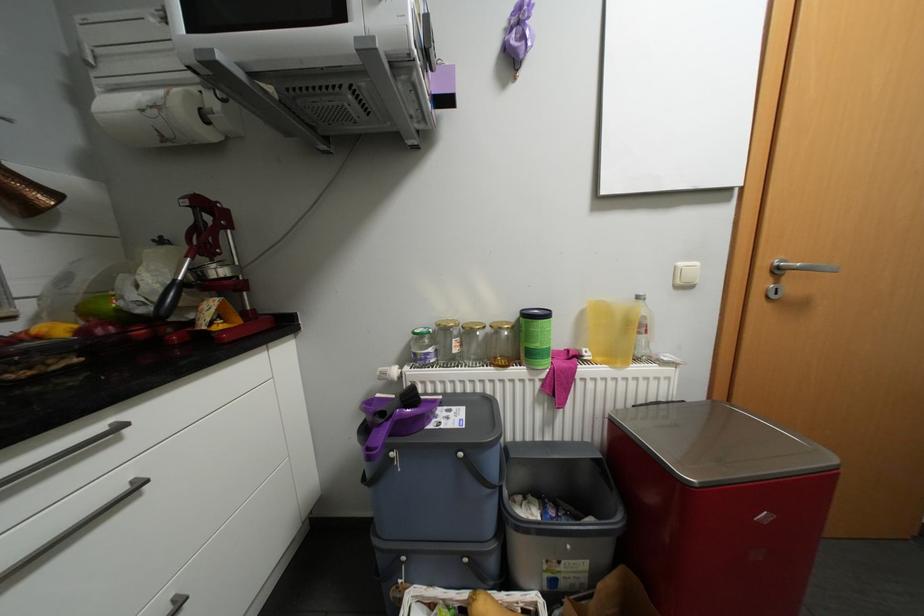
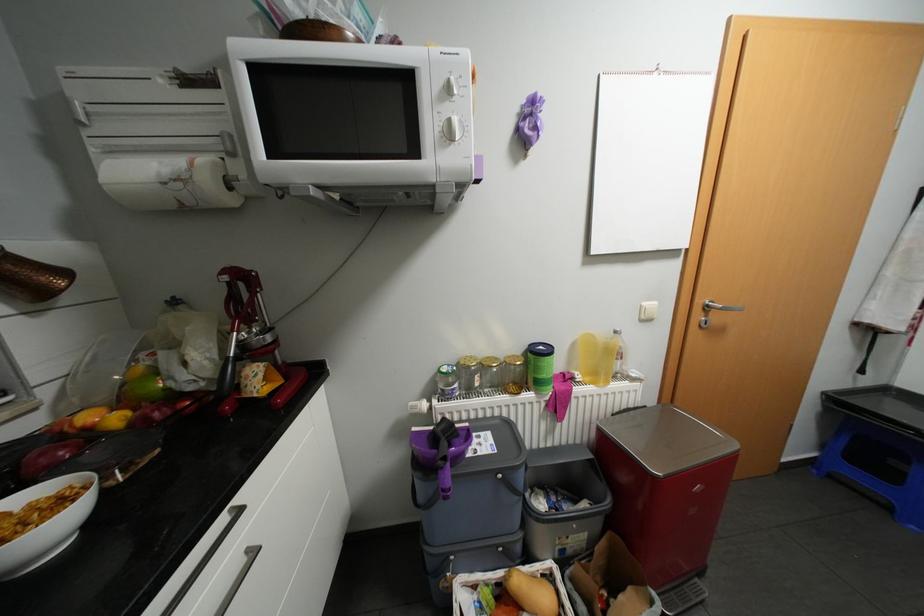
Question: I am providing you with two images of the same scene from different viewpoints. Which of the following objects are not visible in image2?

Choices:
 (A) white light switch
 (B) white microwave dial
 (C) white ceramic bowl
 (D) none of these

Answer: (D)